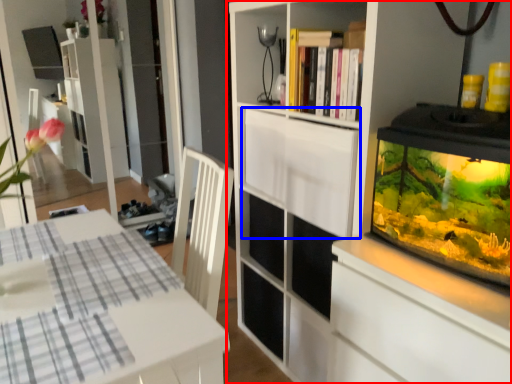
Question: Which object is closer to the camera taking this photo, cupboard (highlighted by a red box) or cabinetry (highlighted by a blue box)?

Choices:
 (A) cupboard
 (B) cabinetry

Answer: (A)